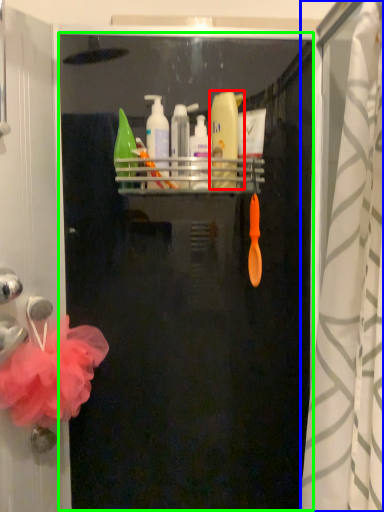
Question: Which is farther away from cleaning product (highlighted by a red box)? shower curtain (highlighted by a blue box) or screen door (highlighted by a green box)?

Choices:
 (A) shower curtain
 (B) screen door

Answer: (A)